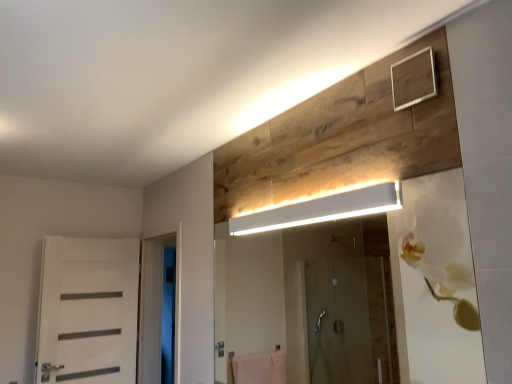
Question: Is white glossy door at left far away from white matte door at left?

Choices:
 (A) no
 (B) yes

Answer: (A)

Question: Is white glossy door at left wider than white matte door at left?

Choices:
 (A) no
 (B) yes

Answer: (B)

Question: Can you confirm if white glossy door at left is taller than white matte door at left?

Choices:
 (A) no
 (B) yes

Answer: (B)

Question: Is white glossy door at left with white matte door at left?

Choices:
 (A) no
 (B) yes

Answer: (A)

Question: Could white matte door at left be considered to be inside white glossy door at left?

Choices:
 (A) no
 (B) yes

Answer: (A)

Question: From a real-world perspective, relative to white matte rectangular light fixture at upper center, is white glossy door at left vertically above or below?

Choices:
 (A) above
 (B) below

Answer: (B)

Question: Is white glossy door at left inside or outside of white matte rectangular light fixture at upper center?

Choices:
 (A) outside
 (B) inside

Answer: (A)

Question: Based on their sizes in the image, would you say white glossy door at left is bigger or smaller than white matte rectangular light fixture at upper center?

Choices:
 (A) small
 (B) big

Answer: (B)

Question: In terms of height, does white glossy door at left look taller or shorter compared to white matte rectangular light fixture at upper center?

Choices:
 (A) short
 (B) tall

Answer: (B)

Question: Based on their sizes in the image, would you say white matte rectangular light fixture at upper center is bigger or smaller than white matte door at left?

Choices:
 (A) small
 (B) big

Answer: (A)

Question: Based on their positions, is white matte rectangular light fixture at upper center located to the left or right of white matte door at left?

Choices:
 (A) left
 (B) right

Answer: (B)

Question: In the image, is white matte rectangular light fixture at upper center positioned in front of or behind white matte door at left?

Choices:
 (A) front
 (B) behind

Answer: (A)

Question: Does point (308, 215) appear closer or farther from the camera than point (132, 367)?

Choices:
 (A) closer
 (B) farther

Answer: (A)

Question: In terms of size, does white matte rectangular light fixture at upper center appear bigger or smaller than white glossy door at left?

Choices:
 (A) small
 (B) big

Answer: (A)

Question: Is white matte rectangular light fixture at upper center inside the boundaries of white glossy door at left, or outside?

Choices:
 (A) inside
 (B) outside

Answer: (B)